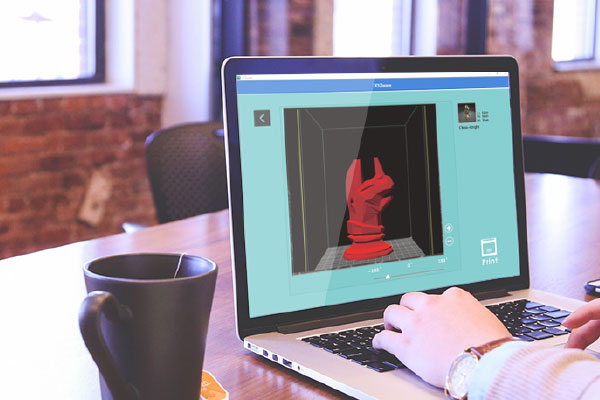
Locate an element on the screen. Image resolution: width=600 pixels, height=400 pixels. brick walls is located at coordinates (47, 161), (545, 98).